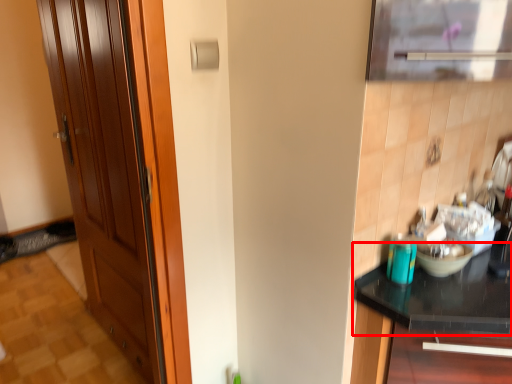
Question: From the image's perspective, considering the relative positions of countertop (annotated by the red box) and door in the image provided, where is countertop (annotated by the red box) located with respect to the staircase?

Choices:
 (A) below
 (B) above

Answer: (A)